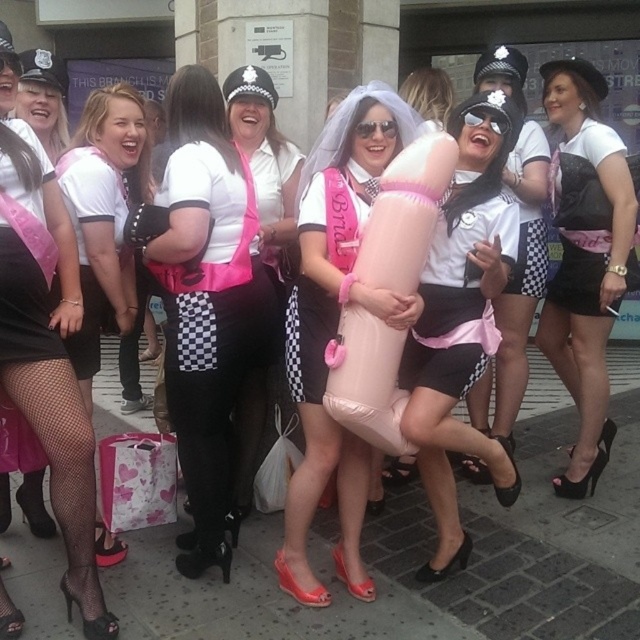
Question: Which object appears farthest from the camera in this image?

Choices:
 (A) pink fabric vest at center
 (B) pink satin inflatable at center

Answer: (A)

Question: Does pink satin dress at center appear over pink matte shorts at center?

Choices:
 (A) yes
 (B) no

Answer: (B)

Question: Which point is farther to the camera?

Choices:
 (A) black leather skirt at center
 (B) pink matte shorts at center
 (C) pink fabric bag at lower left
 (D) matte pink veil at center

Answer: (D)

Question: Considering the relative positions of pink satin dress at center and matte pink veil at center in the image provided, where is pink satin dress at center located with respect to matte pink veil at center?

Choices:
 (A) below
 (B) above

Answer: (A)

Question: Where is pink satin dress at center located in relation to pink fabric bag at lower left in the image?

Choices:
 (A) left
 (B) right

Answer: (B)

Question: Considering the real-world distances, which object is closest to the pink satin inflatable at center?

Choices:
 (A) pink checkered pants at center
 (B) pink matte shorts at center
 (C) pink fabric bag at lower left

Answer: (B)